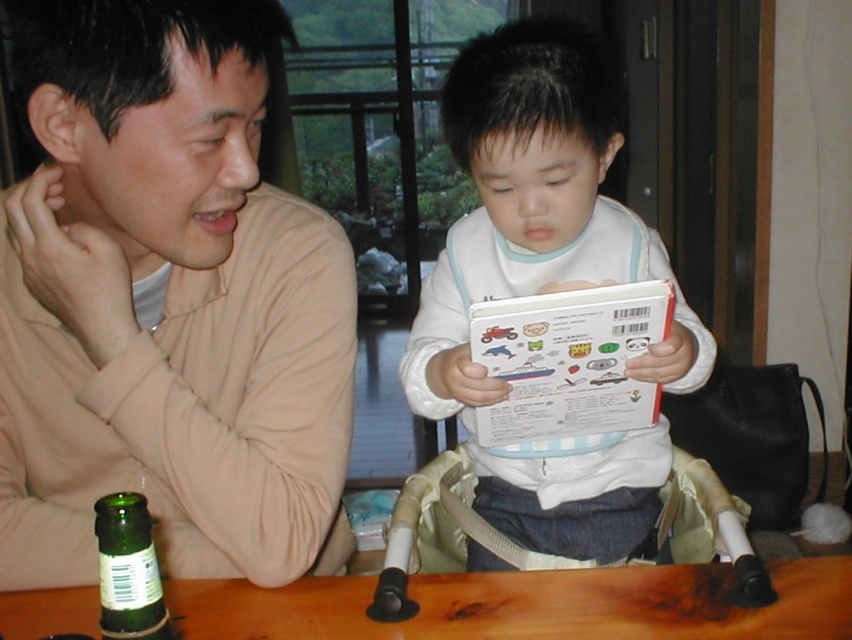
Question: Based on their relative distances, which object is farther from the white matte book at center?

Choices:
 (A) beige soft shirt at upper left
 (B) wooden table at lower center
 (C) green glass bottle at lower left

Answer: (C)

Question: Is white matte book at center wider than green glass bottle at lower left?

Choices:
 (A) no
 (B) yes

Answer: (B)

Question: Which object is positioned closest to the beige soft shirt at upper left?

Choices:
 (A) green glass bottle at lower left
 (B) wooden table at lower center

Answer: (A)

Question: Can you confirm if beige soft shirt at upper left is wider than green glass bottle at lower left?

Choices:
 (A) no
 (B) yes

Answer: (B)

Question: Which object appears farthest from the camera in this image?

Choices:
 (A) wooden table at lower center
 (B) white matte book at center
 (C) beige soft shirt at upper left

Answer: (B)

Question: In this image, where is beige soft shirt at upper left located relative to green glass bottle at lower left?

Choices:
 (A) left
 (B) right

Answer: (B)